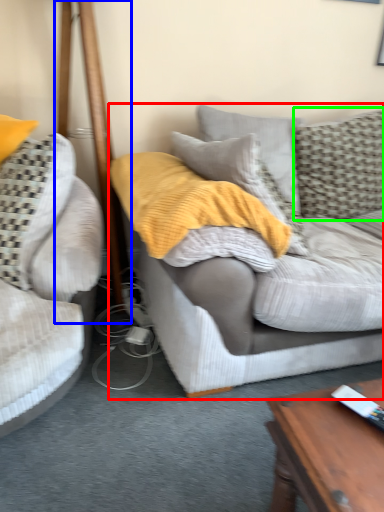
Question: Based on their relative distances, which object is nearer to studio couch (highlighted by a red box)? Choose from pole (highlighted by a blue box) and pillow (highlighted by a green box).

Choices:
 (A) pole
 (B) pillow

Answer: (B)